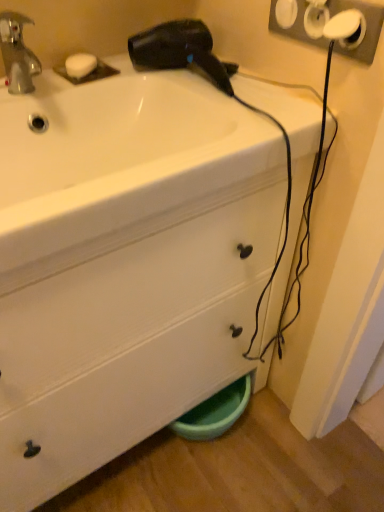
Image resolution: width=384 pixels, height=512 pixels. Find the location of `free location in front of black plastic hair dryer at upper center`. free location in front of black plastic hair dryer at upper center is located at coordinates (245, 120).